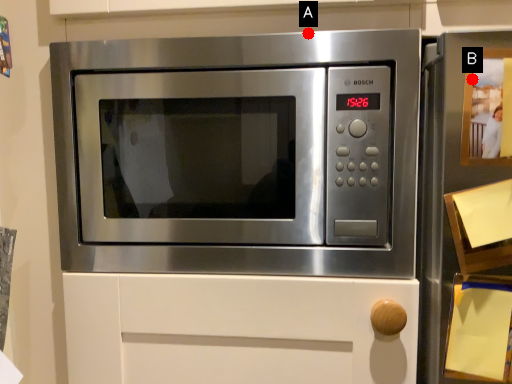
Question: Two points are circled on the image, labeled by A and B beside each circle. Among these points, which one is farthest from the camera?

Choices:
 (A) A is further
 (B) B is further

Answer: (A)